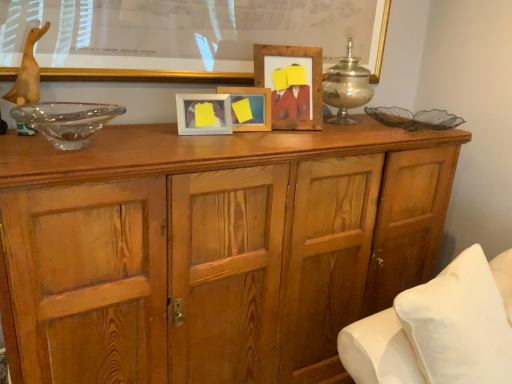
You are a GUI agent. You are given a task and a screenshot of the screen. Output one action in this format:
    pyautogui.click(x=<x>, y=<y>)
    Task: Click on the vacant space to the right of wooden photo frame at center, which is the second picture frame in right-to-left order
    
    Given the screenshot: What is the action you would take?
    pyautogui.click(x=284, y=126)